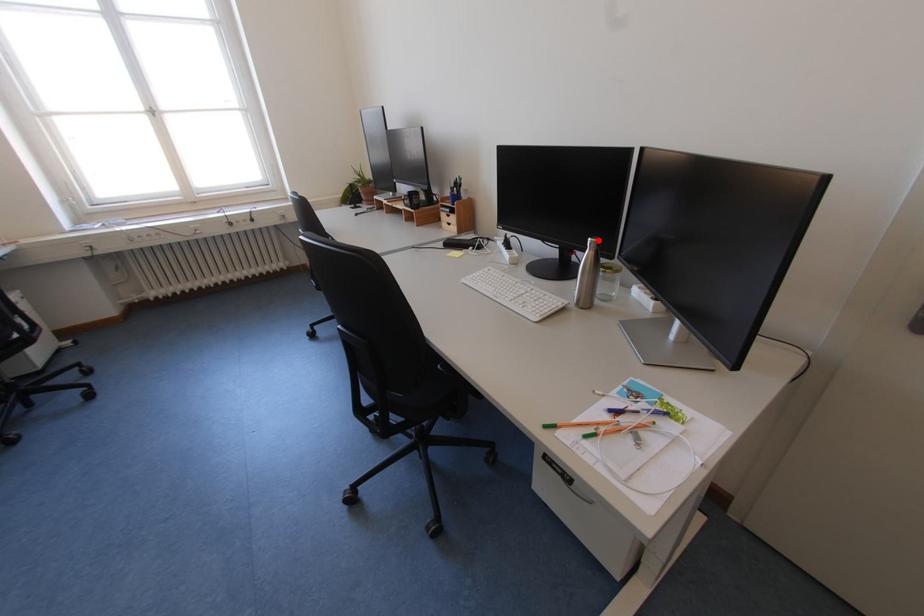
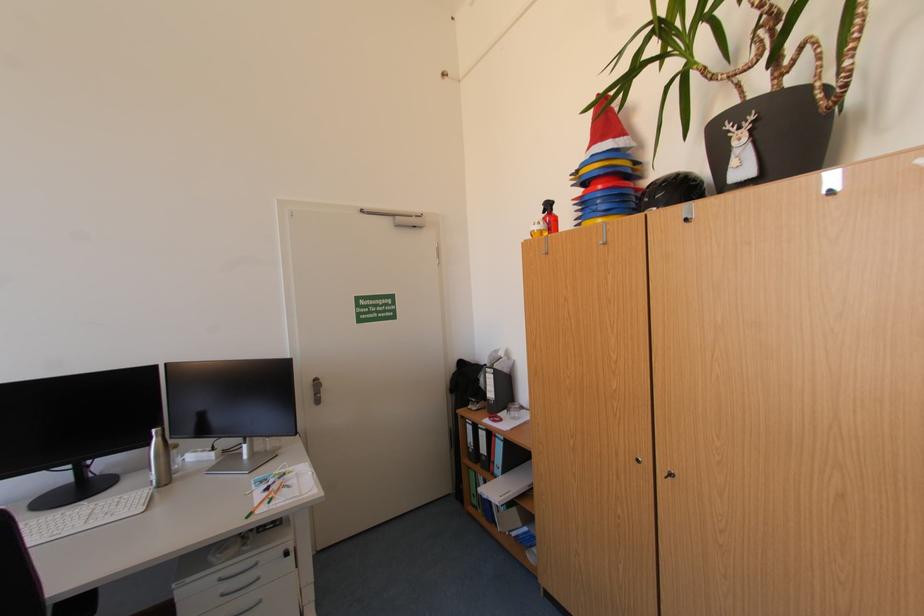
Question: I am providing you with two images of the same scene from different viewpoints. A red point is shown in image1. For the corresponding object point in image2, is it positioned nearer or farther from the camera?

Choices:
 (A) Nearer
 (B) Farther

Answer: (B)